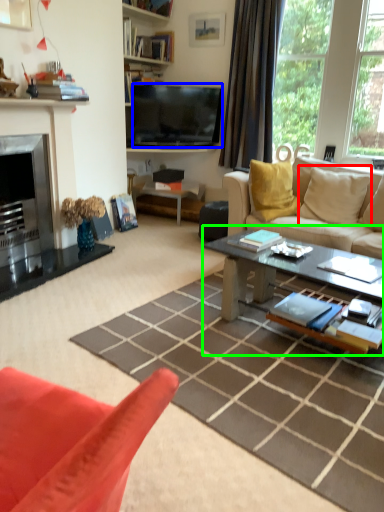
Question: Which object is the closest to the pillow (highlighted by a red box)? Choose among these: television (highlighted by a blue box) or coffee table (highlighted by a green box).

Choices:
 (A) television
 (B) coffee table

Answer: (B)